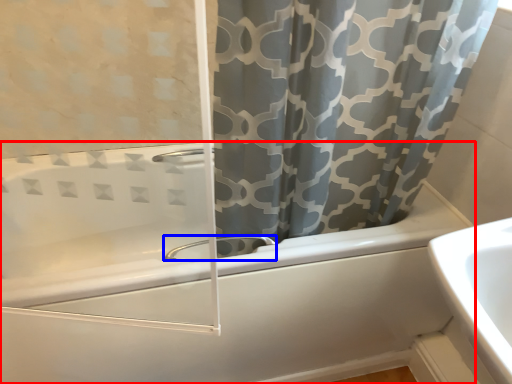
Question: Which object is further to the camera taking this photo, bathtub (highlighted by a red box) or tap (highlighted by a blue box)?

Choices:
 (A) bathtub
 (B) tap

Answer: (B)